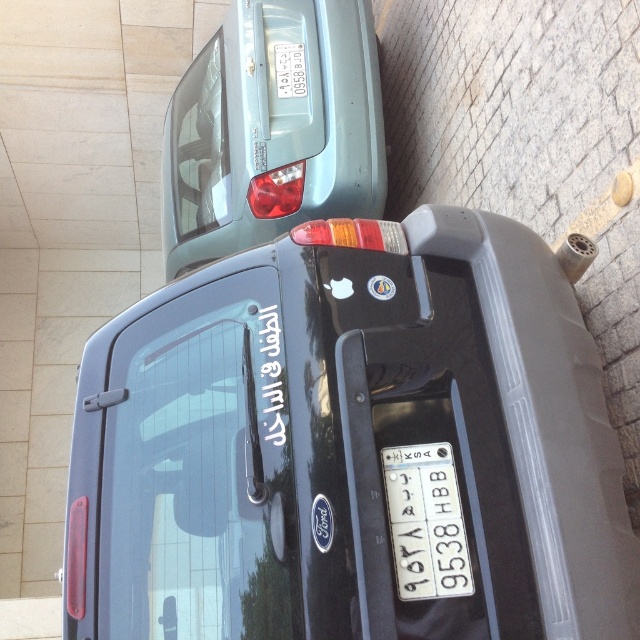
Between satin metallic car at upper center and white plastic license plate at center, which one is positioned lower?

white plastic license plate at center is lower down.

Measure the distance between point (189, 225) and camera.

They are 4.63 meters apart.

Identify the location of satin metallic car at upper center. (273, 129).